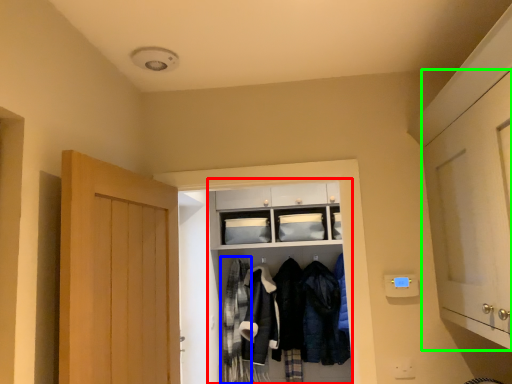
Question: Which object is positioned closest to closet (highlighted by a red box)? Select from clothing (highlighted by a blue box) and door (highlighted by a green box).

Choices:
 (A) clothing
 (B) door

Answer: (A)